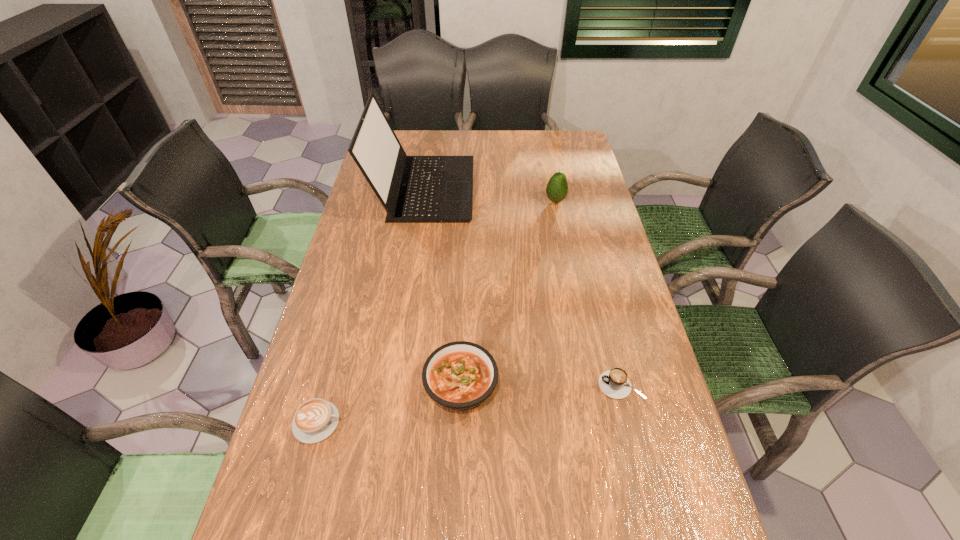
The image size is (960, 540). What are the coordinates of `free space between the third tallest object and the tallest object` in the screenshot? It's located at (443, 287).

Where is `unoccupied position between the tallest object and the third shortest object`? The width and height of the screenshot is (960, 540). unoccupied position between the tallest object and the third shortest object is located at coordinates (443, 287).

Select which object is the third closest to the right cappuccino. Please provide its 2D coordinates. Your answer should be formatted as a tuple, i.e. [(x, y)], where the tuple contains the x and y coordinates of a point satisfying the conditions above.

[(413, 189)]

Locate which object ranks in proximity to the fourth shortest object. Please provide its 2D coordinates. Your answer should be formatted as a tuple, i.e. [(x, y)], where the tuple contains the x and y coordinates of a point satisfying the conditions above.

[(413, 189)]

You are a GUI agent. You are given a task and a screenshot of the screen. Output one action in this format:
    pyautogui.click(x=<x>, y=<y>)
    Task: Click on the blank area in the image that satisfies the following two spatial constraints: 1. on the surface of the laptop; 2. on the back side of the avocado
    This screenshot has height=540, width=960.
    Given the screenshot: What is the action you would take?
    pyautogui.click(x=421, y=200)

What are the coordinates of `vacant space that satisfies the following two spatial constraints: 1. on the surface of the laptop; 2. on the left side of the avocado` in the screenshot? It's located at (421, 200).